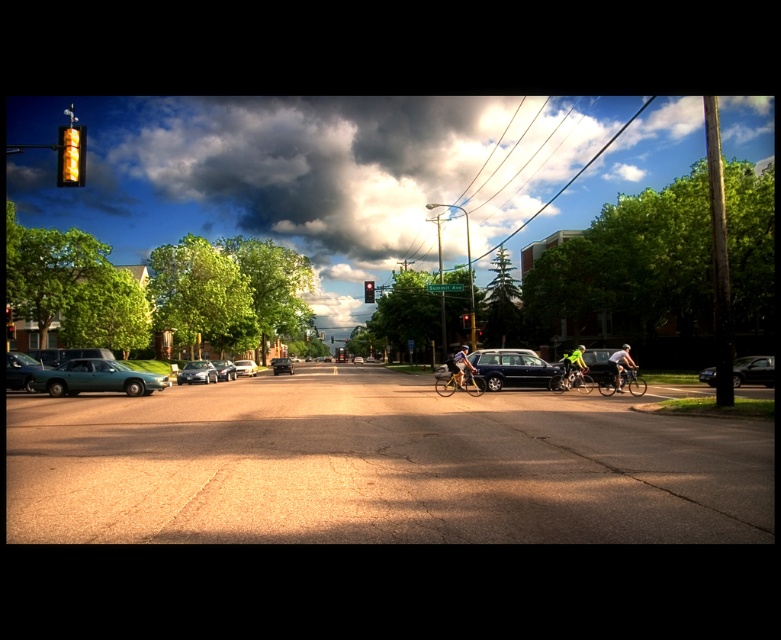
Consider the image. Is shiny silver bicycle at right wider than green fabric cyclist at center?

No.

Measure the distance between shiny silver bicycle at right and camera.

They are 83.54 feet apart.

Find the location of a particular element. shiny silver bicycle at right is located at coordinates [x=621, y=380].

Is cloudy sky at upper center shorter than matte black sedan at left?

No.

This screenshot has height=640, width=781. In order to click on cloudy sky at upper center in this screenshot , I will do `click(339, 170)`.

Is shiny silver bicycle at right wider than amber glass traffic light at upper left?

No.

Where is `shiny silver bicycle at right`? The height and width of the screenshot is (640, 781). shiny silver bicycle at right is located at coordinates (621, 380).